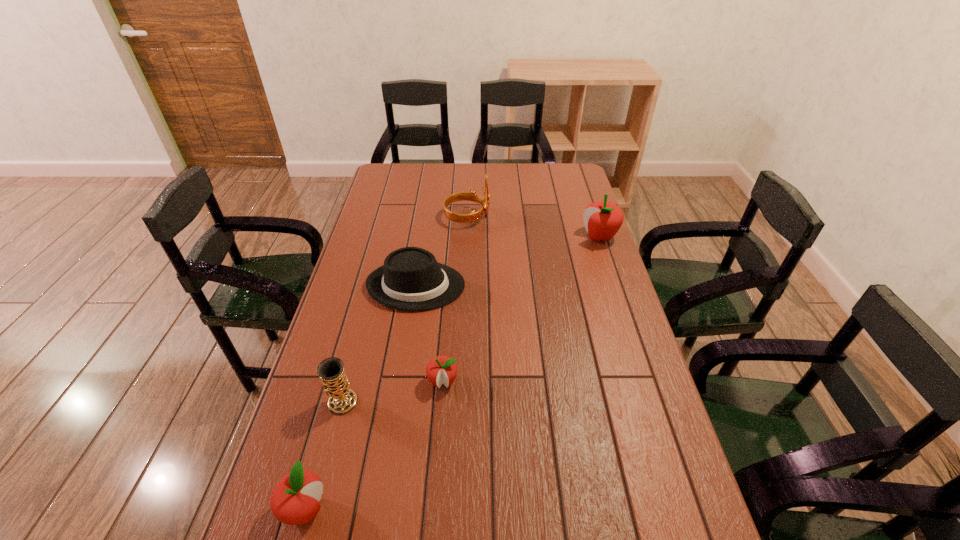
Where is `vacant point that satisfies the following two spatial constraints: 1. on the front-facing side of the tiara; 2. on the front side of the third tallest object`? This screenshot has width=960, height=540. vacant point that satisfies the following two spatial constraints: 1. on the front-facing side of the tiara; 2. on the front side of the third tallest object is located at coordinates (460, 402).

At what (x,y) coordinates should I click in order to perform the action: click on free space that satisfies the following two spatial constraints: 1. on the front side of the tallest apple; 2. on the front-facing side of the third farthest object. Please return your answer as a coordinate pair (x, y). Looking at the image, I should click on (615, 286).

Where is `free space that satisfies the following two spatial constraints: 1. on the back side of the farthest apple; 2. on the right side of the third tallest object`? free space that satisfies the following two spatial constraints: 1. on the back side of the farthest apple; 2. on the right side of the third tallest object is located at coordinates (386, 237).

The width and height of the screenshot is (960, 540). Identify the location of free space that satisfies the following two spatial constraints: 1. on the back side of the second nearest apple; 2. on the front-facing side of the third farthest object. (450, 286).